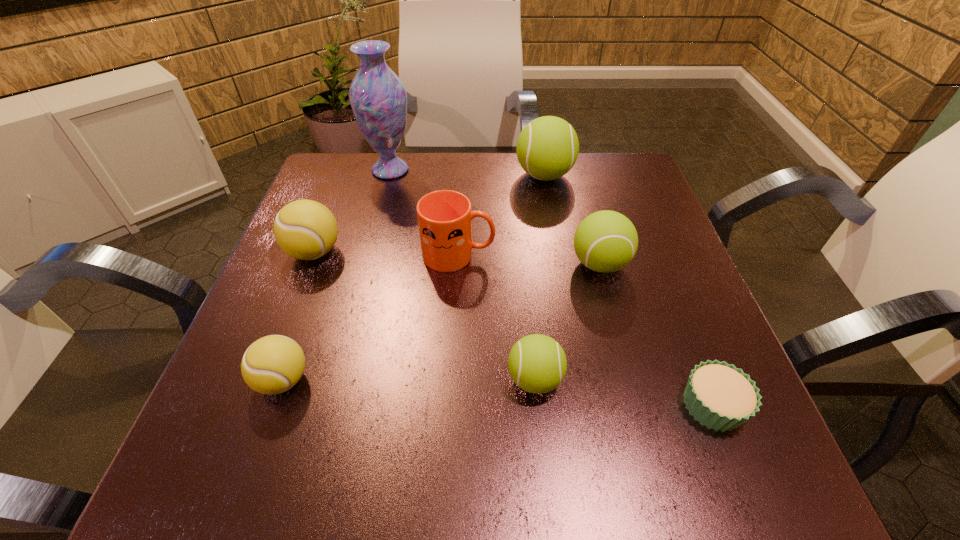
In the image, there is a desktop. Find the location of `vacant space at the left edge`. vacant space at the left edge is located at coordinates (265, 311).

You are a GUI agent. You are given a task and a screenshot of the screen. Output one action in this format:
    pyautogui.click(x=<x>, y=<y>)
    Task: Click on the vacant region at the right edge
    The height and width of the screenshot is (540, 960).
    Given the screenshot: What is the action you would take?
    pyautogui.click(x=669, y=240)

The width and height of the screenshot is (960, 540). Identify the location of vacant space at the far left corner of the desktop. click(348, 163).

Where is `vacant region at the near left corner of the desktop`? The height and width of the screenshot is (540, 960). vacant region at the near left corner of the desktop is located at coordinates (188, 464).

In the image, there is a desktop. At what (x,y) coordinates should I click in order to perform the action: click on vacant area at the far right corner. Please return your answer as a coordinate pair (x, y). The width and height of the screenshot is (960, 540). Looking at the image, I should click on (595, 197).

Where is `vacant space at the near right corner of the desktop`? vacant space at the near right corner of the desktop is located at coordinates (737, 471).

I want to click on free area in between the mug and the bigger yellow tennis ball, so click(386, 254).

Identify the location of free space between the second farthest green tennis ball and the smaller yellow tennis ball. (442, 322).

Find the location of a particular element. empty space that is in between the tallest object and the rightmost object is located at coordinates (551, 288).

Locate an element on the screen. unoccupied position between the tallest object and the smaller yellow tennis ball is located at coordinates (337, 275).